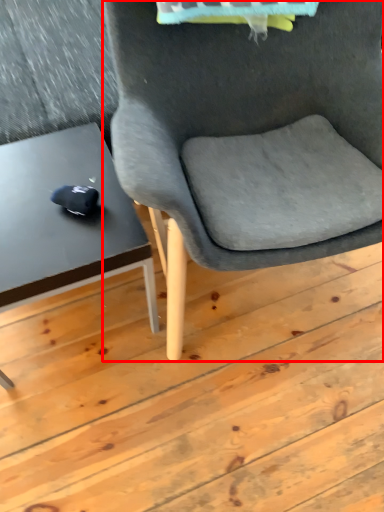
Question: Observing the image, what is the correct spatial positioning of chair (annotated by the red box) in reference to table?

Choices:
 (A) right
 (B) left

Answer: (A)